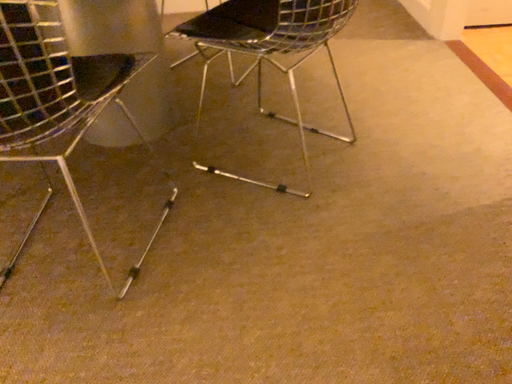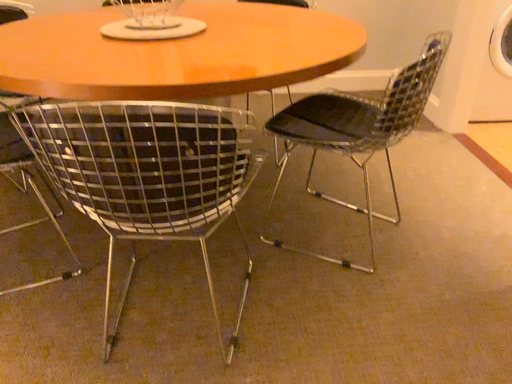
Question: Which way did the camera rotate in the video?

Choices:
 (A) rotated downward
 (B) rotated upward

Answer: (B)